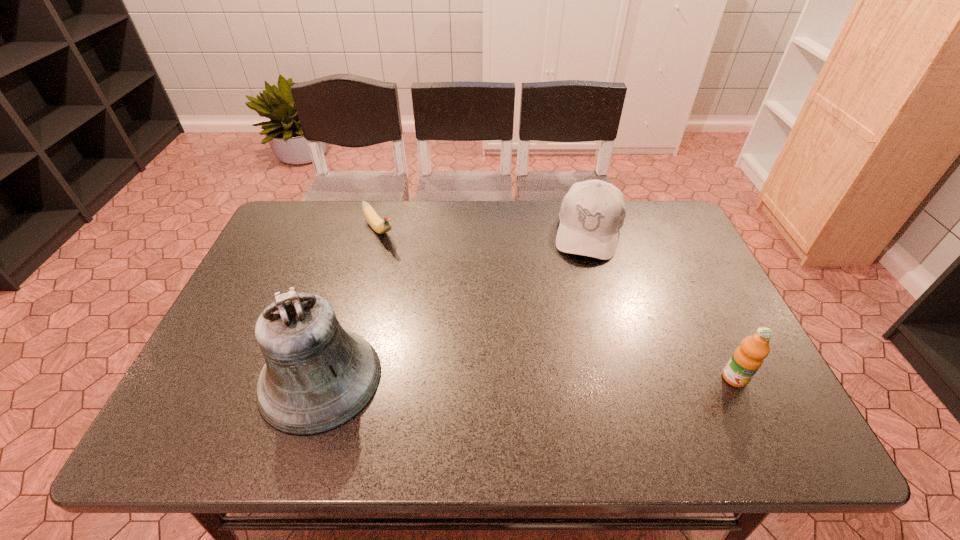
Locate an element on the screen. Image resolution: width=960 pixels, height=540 pixels. vacant space located 0.200m on the front-facing side of the second object from right to left is located at coordinates (575, 310).

The width and height of the screenshot is (960, 540). Identify the location of banana positioned at the far edge. (380, 226).

In order to click on baseball cap at the far edge in this screenshot , I will do `click(592, 213)`.

Identify the location of bell that is at the near edge. This screenshot has height=540, width=960. (318, 376).

This screenshot has height=540, width=960. In order to click on orange juice at the near edge in this screenshot , I will do `click(749, 356)`.

Locate an element on the screen. The image size is (960, 540). object positioned at the left edge is located at coordinates (318, 376).

Locate an element on the screen. object at the right edge is located at coordinates (749, 356).

Where is `object located at the near left corner`? The width and height of the screenshot is (960, 540). object located at the near left corner is located at coordinates (318, 376).

Identify the location of object situated at the near right corner. (749, 356).

Find the location of a particular element. The width and height of the screenshot is (960, 540). vacant space at the far edge is located at coordinates (552, 212).